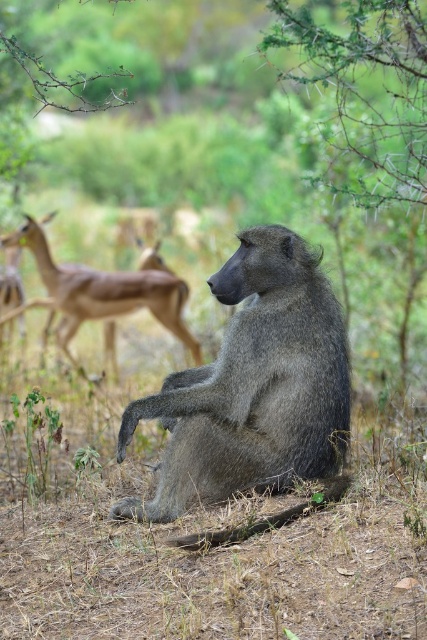
Question: Is green spiny branch at upper right wider than brown glossy antelope at left?

Choices:
 (A) yes
 (B) no

Answer: (B)

Question: Which object is farther from the camera taking this photo?

Choices:
 (A) green spiny branch at upper right
 (B) gray furry baboon at center

Answer: (A)

Question: Which point is farther from the camera taking this photo?

Choices:
 (A) (175, 476)
 (B) (335, 45)

Answer: (B)

Question: Is gray furry baboon at center positioned before green spiny branch at upper right?

Choices:
 (A) yes
 (B) no

Answer: (A)

Question: In this image, where is gray furry baboon at center located relative to brown glossy antelope at left?

Choices:
 (A) left
 (B) right

Answer: (B)

Question: Which object is positioned closest to the green spiny branch at upper right?

Choices:
 (A) brown glossy antelope at left
 (B) gray furry baboon at center

Answer: (B)